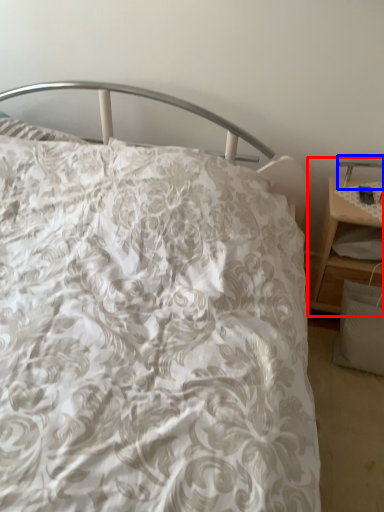
Question: Which of the following is the farthest to the observer, nightstand (highlighted by a red box) or table lamp (highlighted by a blue box)?

Choices:
 (A) nightstand
 (B) table lamp

Answer: (B)